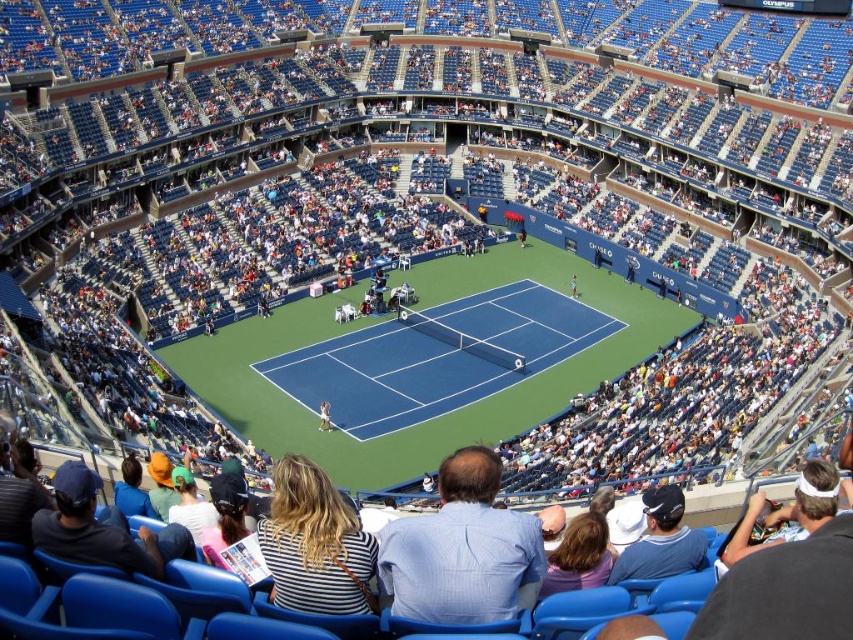
Can you confirm if blue striped shirt at center is positioned below striped shirt at center?

No, blue striped shirt at center is not below striped shirt at center.

Who is more distant from viewer, (448, 577) or (564, 544)?

Point (564, 544)

The height and width of the screenshot is (640, 853). I want to click on blue striped shirt at center, so click(462, 550).

Does white cotton shirt at lower left have a greater width compared to white fabric tennis racket at center?

Correct, the width of white cotton shirt at lower left exceeds that of white fabric tennis racket at center.

Who is more forward, (189, 493) or (329, 417)?

Point (189, 493) is in front.

Image resolution: width=853 pixels, height=640 pixels. I want to click on white cotton shirt at lower left, so click(190, 506).

Does blue striped shirt at center have a lesser height compared to striped fabric shirt at lower center?

No.

Find the location of a particular element. The image size is (853, 640). blue striped shirt at center is located at coordinates (462, 550).

At what (x,y) coordinates should I click in order to perform the action: click on blue striped shirt at center. Please return your answer as a coordinate pair (x, y). Looking at the image, I should click on (462, 550).